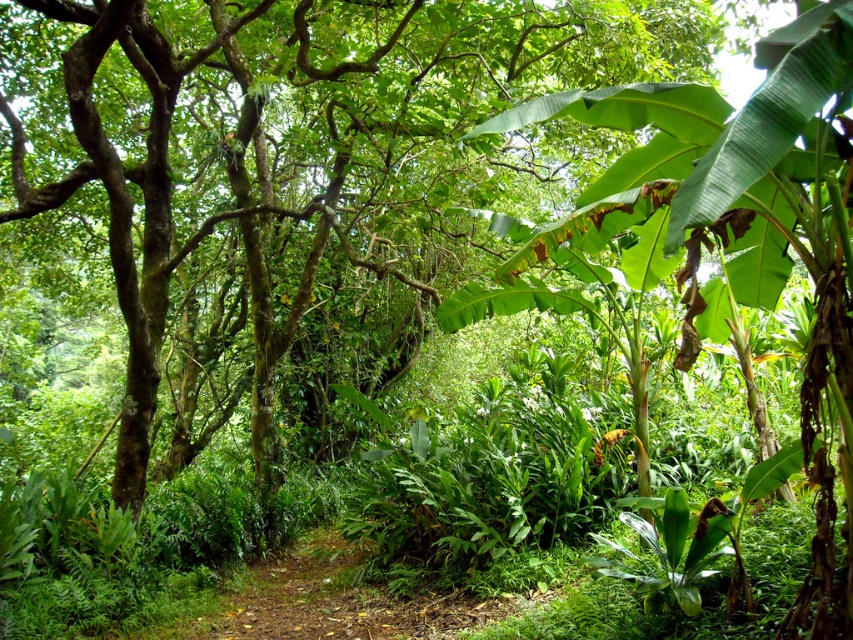
Question: Does green leafy tree at center lie in front of green leafy banana tree at right?

Choices:
 (A) no
 (B) yes

Answer: (A)

Question: Does green leafy tree at center lie in front of green leafy banana tree at right?

Choices:
 (A) no
 (B) yes

Answer: (A)

Question: Is green leafy tree at center smaller than green leafy banana tree at right?

Choices:
 (A) no
 (B) yes

Answer: (A)